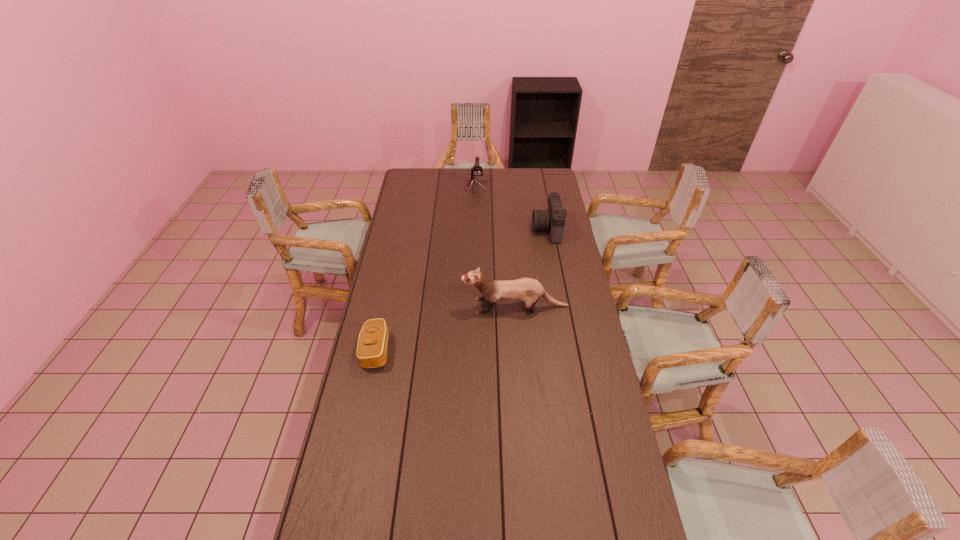
Where is `vacant space located at the lens of the third nearest object`? vacant space located at the lens of the third nearest object is located at coordinates (516, 230).

Where is `vacant space situated at the lens of the third nearest object`? The width and height of the screenshot is (960, 540). vacant space situated at the lens of the third nearest object is located at coordinates (462, 230).

You are a GUI agent. You are given a task and a screenshot of the screen. Output one action in this format:
    pyautogui.click(x=<x>, y=<y>)
    Task: Click on the vacant position located on the zipper side of the shortest object
    This screenshot has width=960, height=540.
    Given the screenshot: What is the action you would take?
    pyautogui.click(x=477, y=350)

In order to click on object that is at the far edge in this screenshot , I will do pos(476,171).

Identify the location of object located in the left edge section of the desktop. Image resolution: width=960 pixels, height=540 pixels. (372, 347).

The height and width of the screenshot is (540, 960). In order to click on ferret at the right edge in this screenshot , I will do `click(527, 290)`.

I want to click on camera that is at the right edge, so click(x=553, y=219).

Image resolution: width=960 pixels, height=540 pixels. In the image, there is a desktop. What are the coordinates of `vacant space at the far edge` in the screenshot? It's located at (454, 179).

This screenshot has width=960, height=540. What are the coordinates of `free point at the left edge` in the screenshot? It's located at (343, 463).

In the image, there is a desktop. In order to click on blank space at the right edge in this screenshot , I will do (566, 288).